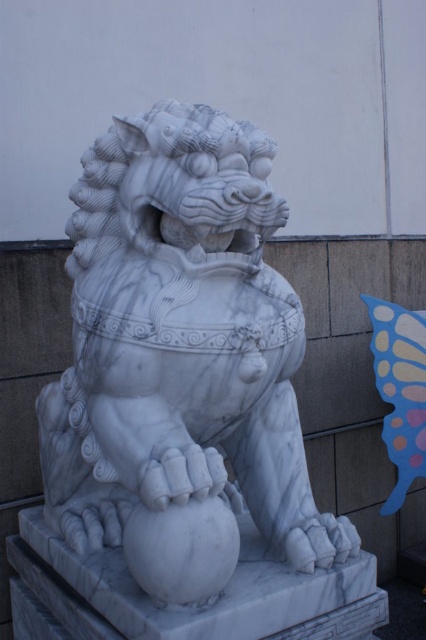
Is point (112, 196) more distant than point (394, 317)?

No, it is in front of (394, 317).

Who is more forward, (238,289) or (385,316)?

Point (238,289) is more forward.

Is point (233, 356) positioned after point (382, 307)?

No.

Find the location of `white marble lion at center`. white marble lion at center is located at coordinates (181, 340).